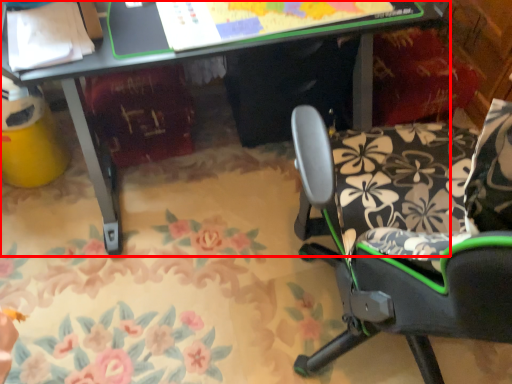
Question: From the image's perspective, where is desk (annotated by the red box) located in relation to chair in the image?

Choices:
 (A) below
 (B) above

Answer: (B)